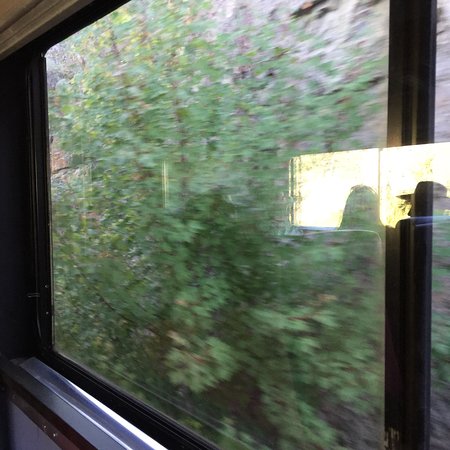
Find the location of a particular element. window is located at coordinates (195, 286).